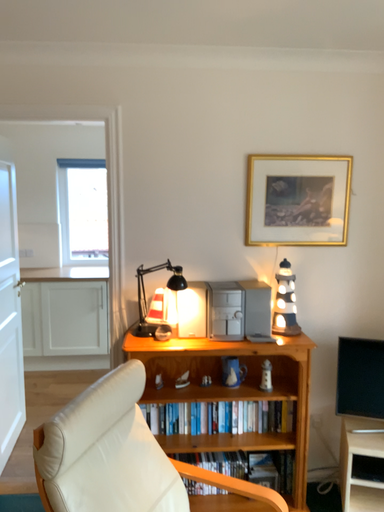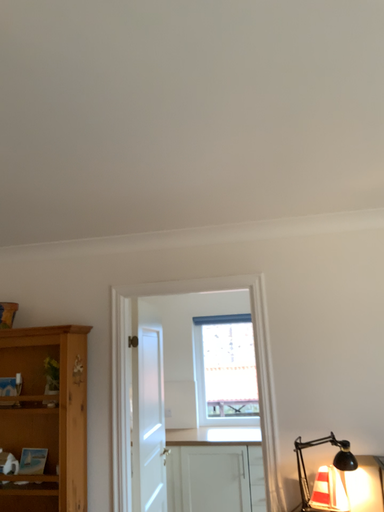
Question: Which way did the camera rotate in the video?

Choices:
 (A) rotated upward
 (B) rotated downward

Answer: (A)